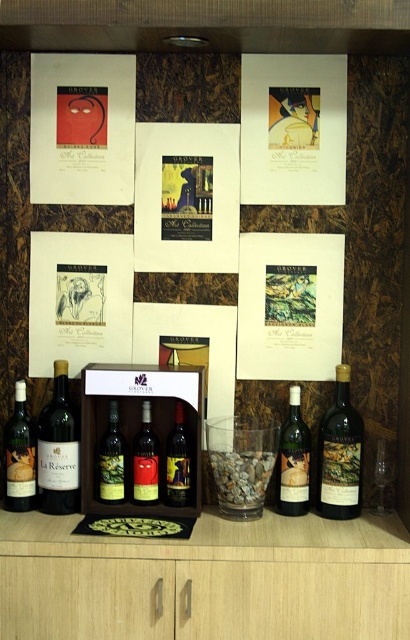
You are an interior designer arranging items on a rustic wooden wall. You have a dark red glass bottle at lower left and a matte black wine bottle at center. Which bottle is closer to the viewer?

The dark red glass bottle at lower left is closer to the viewer because it is in front of the matte black wine bottle at center.

You are an interior designer planning to add a new painting to the wall. The current setup has the Art Collection by Grover arranged in two rows of three frames. There is also a matte glass wine bottle at right represented by point [339,454]. Where should you place the new painting so it doesn

The new painting should be placed in the bottom row to maintain the two rows of three frames. Since the wine bottle is located at point [339,454], which is in the bottom row, placing the new painting in the bottom row would balance the arrangement while accommodating the existing items.